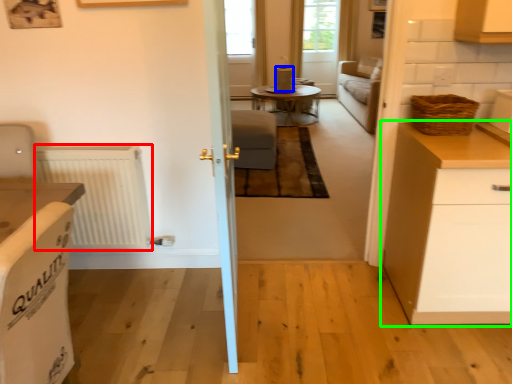
Question: Considering the real-world distances, which object is farthest from radiator (highlighted by a red box)? appliance (highlighted by a blue box) or cabinetry (highlighted by a green box)?

Choices:
 (A) appliance
 (B) cabinetry

Answer: (A)